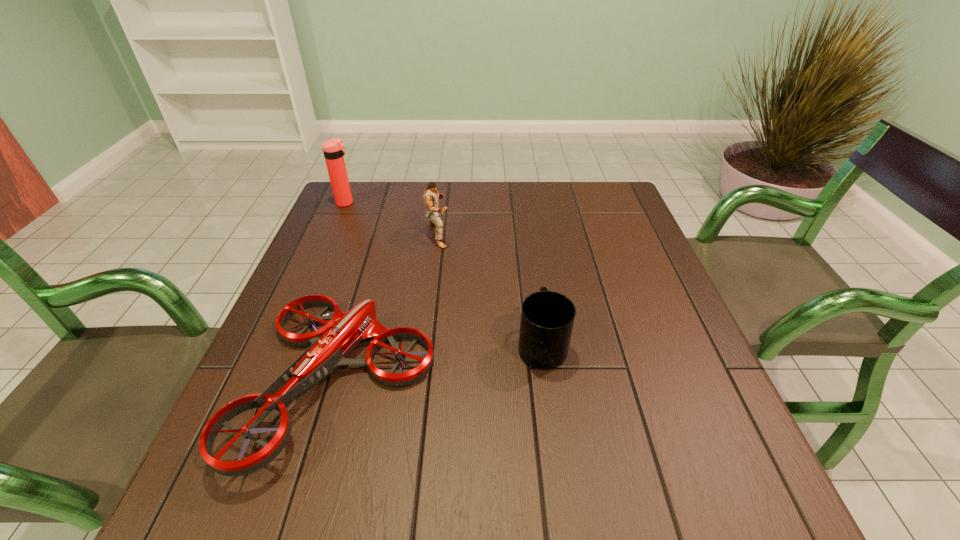
In order to click on free space located on the side of the mug with the handle in this screenshot , I will do `click(530, 259)`.

You are a GUI agent. You are given a task and a screenshot of the screen. Output one action in this format:
    pyautogui.click(x=<x>, y=<y>)
    Task: Click on the vacant space located 0.260m on the side of the mug with the handle
    
    Given the screenshot: What is the action you would take?
    pyautogui.click(x=529, y=250)

Where is `free point located on the right of the drone`? The height and width of the screenshot is (540, 960). free point located on the right of the drone is located at coordinates (509, 380).

Identify the location of object situated at the far edge. Image resolution: width=960 pixels, height=540 pixels. (333, 149).

Where is `object present at the near edge`? Image resolution: width=960 pixels, height=540 pixels. object present at the near edge is located at coordinates (330, 345).

Locate an element on the screen. The image size is (960, 540). thermos bottle that is at the left edge is located at coordinates (333, 149).

At what (x,y) coordinates should I click in order to perform the action: click on drone that is at the left edge. Please return your answer as a coordinate pair (x, y). The height and width of the screenshot is (540, 960). Looking at the image, I should click on (330, 345).

I want to click on object situated at the far left corner, so click(333, 149).

This screenshot has width=960, height=540. I want to click on object positioned at the near left corner, so click(x=330, y=345).

Image resolution: width=960 pixels, height=540 pixels. In the image, there is a desktop. What are the coordinates of `vacant space at the far edge` in the screenshot? It's located at (519, 204).